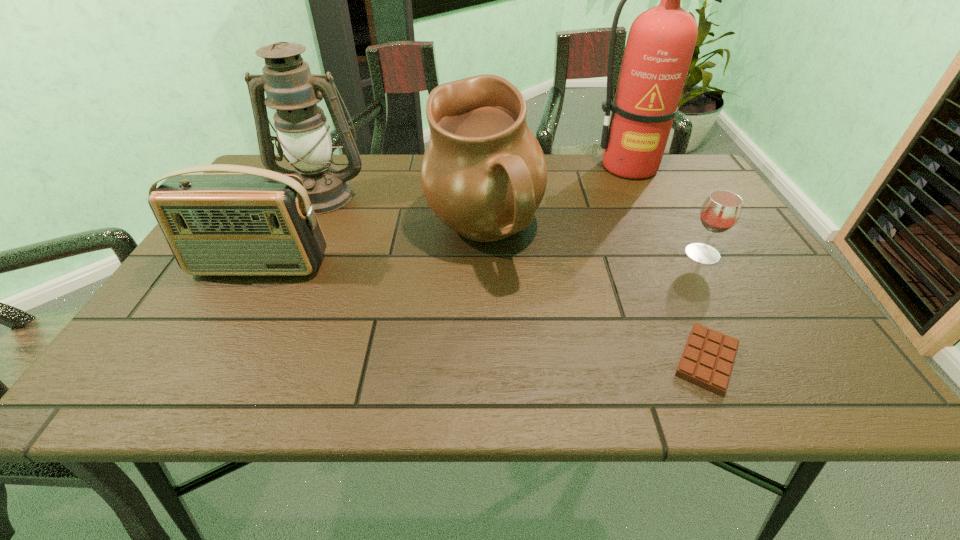
Where is `vacant point located between the candy bar and the tallest object`? This screenshot has width=960, height=540. vacant point located between the candy bar and the tallest object is located at coordinates (667, 263).

Where is `free space that is in between the fourth tallest object and the wineglass`? The image size is (960, 540). free space that is in between the fourth tallest object and the wineglass is located at coordinates (481, 260).

Locate an element on the screen. The image size is (960, 540). vacant point located between the wineglass and the candy bar is located at coordinates (705, 306).

At what (x,y) coordinates should I click in order to perform the action: click on empty location between the third object from left to right and the tallest object. Please return your answer as a coordinate pair (x, y). The image size is (960, 540). Looking at the image, I should click on (x=556, y=201).

Where is `free point between the tallest object and the fourth shortest object`? Image resolution: width=960 pixels, height=540 pixels. free point between the tallest object and the fourth shortest object is located at coordinates (556, 201).

Identify the location of vacant point located between the shortest object and the fire extinguisher. (667, 263).

Find the location of `the second closest object to the fire extinguisher`. the second closest object to the fire extinguisher is located at coordinates click(721, 210).

Identify which object is located as the nearest to the shortest object. Please provide its 2D coordinates. Your answer should be formatted as a tuple, i.e. [(x, y)], where the tuple contains the x and y coordinates of a point satisfying the conditions above.

[(721, 210)]

The width and height of the screenshot is (960, 540). In order to click on blank space that satisfies the following two spatial constraints: 1. at the spout of the cream pitcher; 2. on the front-facing side of the fourth tallest object in this screenshot , I will do `click(484, 266)`.

Identify the location of free space that satisfies the following two spatial constraints: 1. on the front-facing side of the third shortest object; 2. on the left side of the candy bar. This screenshot has height=540, width=960. (208, 360).